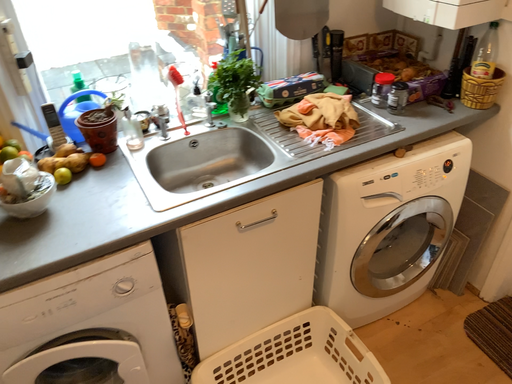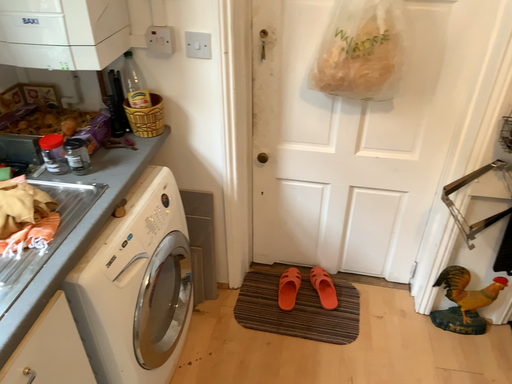
Question: Which way did the camera rotate in the video?

Choices:
 (A) rotated left
 (B) rotated right

Answer: (B)